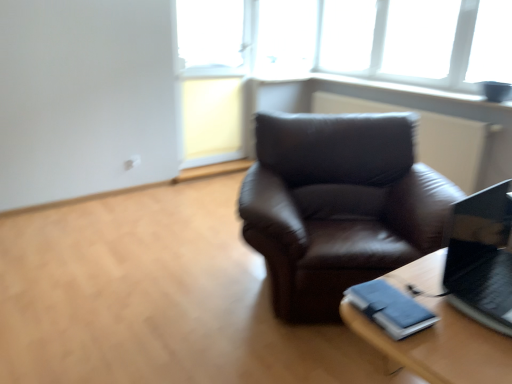
The width and height of the screenshot is (512, 384). In order to click on free space between blue fabric binder at lower right and shiny black laptop at right in this screenshot , I will do `click(434, 306)`.